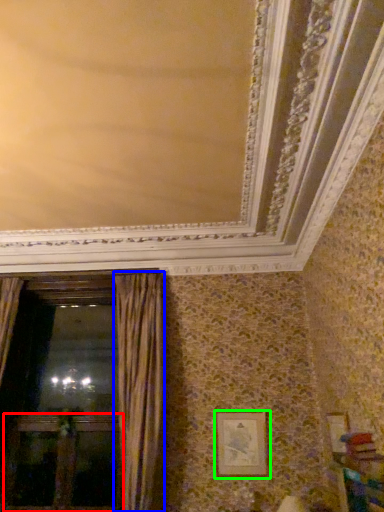
Question: Estimate the real-world distances between objects in this image. Which object is closer to screen door (highlighted by a red box), curtain (highlighted by a blue box) or picture frame (highlighted by a green box)?

Choices:
 (A) curtain
 (B) picture frame

Answer: (A)